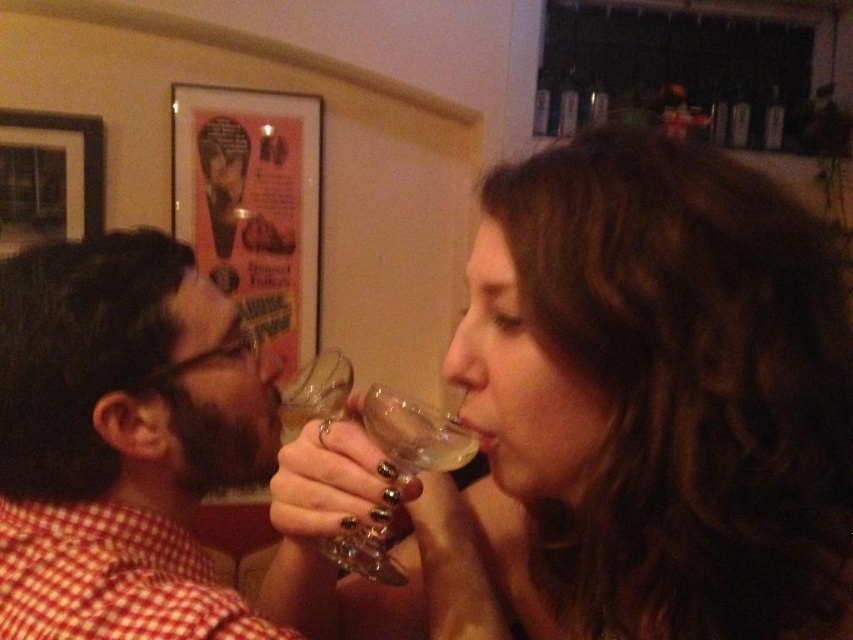
Question: Can you confirm if translucent glass at upper right is bigger than transparent glass at center?

Choices:
 (A) yes
 (B) no

Answer: (B)

Question: Which point appears farthest from the camera in this image?

Choices:
 (A) (86, 184)
 (B) (294, 429)

Answer: (A)

Question: Is the position of translucent glass at upper right less distant than that of transparent glass at center?

Choices:
 (A) no
 (B) yes

Answer: (B)

Question: Which point is closer to the camera?

Choices:
 (A) brushed metal picture frame at upper left
 (B) transparent glass at center

Answer: (B)

Question: Based on their relative distances, which object is nearer to the matte glass wine at left?

Choices:
 (A) translucent glass at upper right
 (B) transparent glass at center

Answer: (B)

Question: Does translucent glass at upper right have a greater width compared to transparent glass wine glass at center?

Choices:
 (A) no
 (B) yes

Answer: (B)